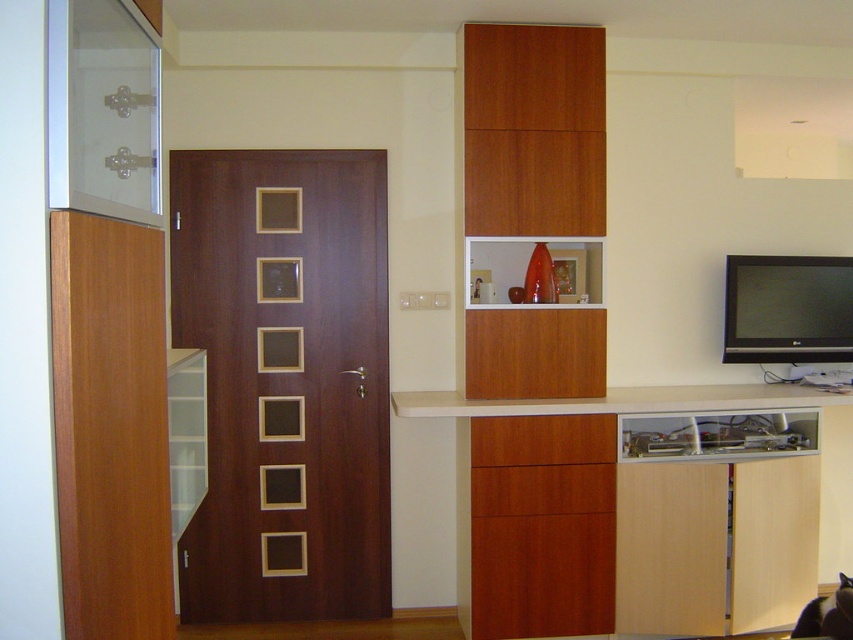
Question: Which object is closer to the camera taking this photo?

Choices:
 (A) black glossy tv at right
 (B) wooden cabinet at lower center

Answer: (B)

Question: Is wooden cabinet at lower center positioned at the back of wooden drawer at lower center?

Choices:
 (A) no
 (B) yes

Answer: (A)

Question: Is black glossy tv at right positioned in front of wooden drawer at lower center?

Choices:
 (A) yes
 (B) no

Answer: (B)

Question: Which point is closer to the camera?

Choices:
 (A) (508, 422)
 (B) (817, 349)

Answer: (A)

Question: Among these points, which one is nearest to the camera?

Choices:
 (A) (505, 420)
 (B) (556, 490)

Answer: (A)

Question: Does wooden cabinet at lower center appear over wooden drawer at lower center?

Choices:
 (A) yes
 (B) no

Answer: (A)